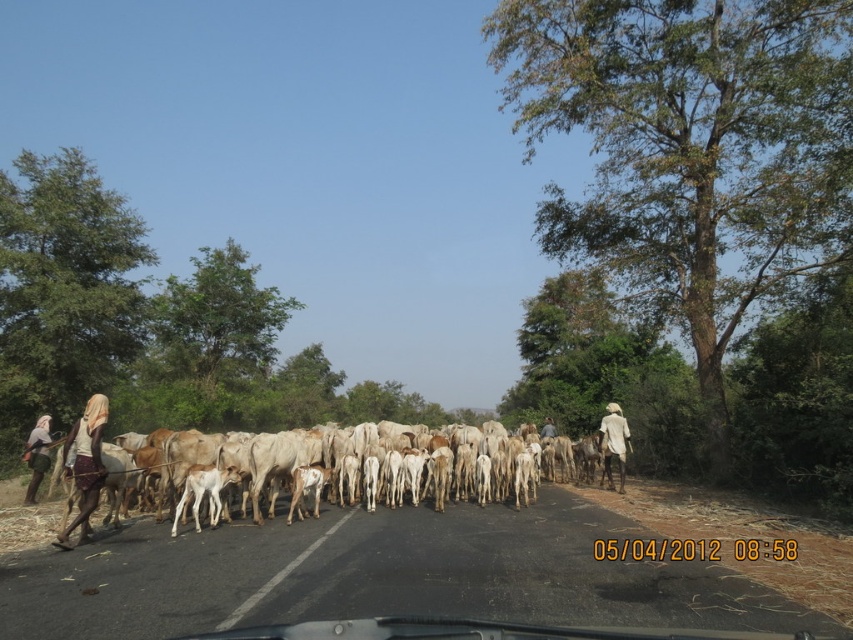
Question: Which point is closer to the camera?

Choices:
 (A) (80, 419)
 (B) (621, 472)

Answer: (A)

Question: Which object is the farthest from the white cloth at right?

Choices:
 (A) white woolly cows at center
 (B) brown fabric headscarf at center

Answer: (A)

Question: Which of the following is the closest to the observer?

Choices:
 (A) (611, 410)
 (B) (74, 435)

Answer: (B)

Question: Is light brown fabric at left above brown fabric headscarf at center?

Choices:
 (A) no
 (B) yes

Answer: (B)

Question: Does white cloth at left have a larger size compared to white cloth at right?

Choices:
 (A) yes
 (B) no

Answer: (B)

Question: Does white cloth at right appear over brown fabric headscarf at center?

Choices:
 (A) no
 (B) yes

Answer: (B)